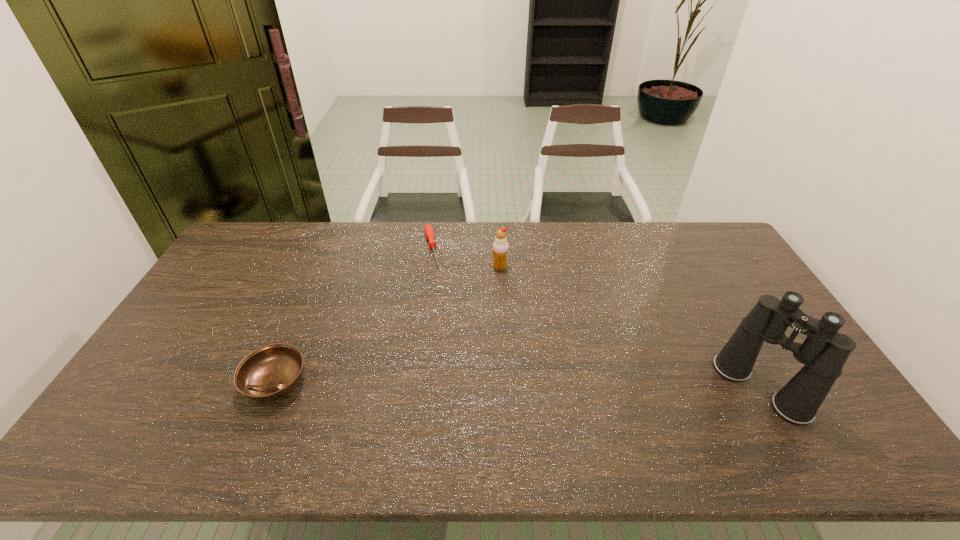
Identify the location of object present at the near right corner. This screenshot has height=540, width=960. (824, 352).

Where is `vacant area at the far edge of the desktop`? This screenshot has width=960, height=540. vacant area at the far edge of the desktop is located at coordinates (556, 233).

In the image, there is a desktop. At what (x,y) coordinates should I click in order to perform the action: click on vacant space at the near edge. Please return your answer as a coordinate pair (x, y). Looking at the image, I should click on (398, 397).

Where is `vacant space at the left edge of the desktop`? The height and width of the screenshot is (540, 960). vacant space at the left edge of the desktop is located at coordinates (226, 273).

In the image, there is a desktop. Identify the location of vacant space at the right edge. (743, 313).

I want to click on vacant area at the far right corner of the desktop, so click(703, 232).

Locate an element on the screen. The width and height of the screenshot is (960, 540). free space between the icecream and the tallest object is located at coordinates (630, 328).

Locate an element on the screen. The width and height of the screenshot is (960, 540). vacant area that lies between the third object from left to right and the tallest object is located at coordinates (630, 328).

This screenshot has height=540, width=960. In order to click on vacant area between the rightmost object and the second object from left to right in this screenshot , I will do `click(596, 319)`.

Locate an element on the screen. This screenshot has height=540, width=960. free space that is in between the third tallest object and the third object from left to right is located at coordinates (388, 325).